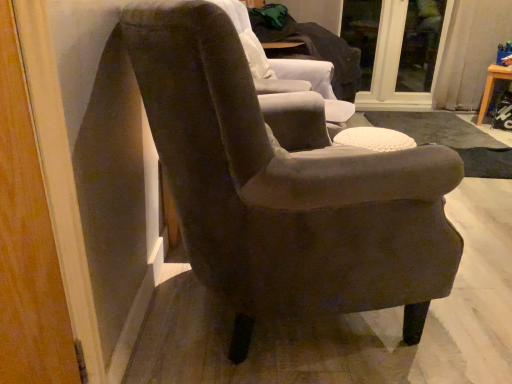
This screenshot has height=384, width=512. In order to click on velvet-like brown armchair at center, which appears as the 1th chair when viewed from the back in this screenshot , I will do [x=288, y=68].

Where is `wooden stool at right`? wooden stool at right is located at coordinates [492, 87].

This screenshot has width=512, height=384. I want to click on velvet-like brown armchair at center, placed as the second chair when sorted from front to back, so click(288, 68).

Considering the positions of objects transparent glass door at upper center, which appears as the second glass door when viewed from the right, and suede-like brown armchair at center, arranged as the 1th chair when viewed from the front, in the image provided, who is more to the right, transparent glass door at upper center, which appears as the second glass door when viewed from the right, or suede-like brown armchair at center, arranged as the 1th chair when viewed from the front,?

Positioned to the right is transparent glass door at upper center, which appears as the second glass door when viewed from the right.

From a real-world perspective, is transparent glass door at upper center, which appears as the second glass door when viewed from the right, physically located above or below suede-like brown armchair at center, marked as the second chair in a back-to-front arrangement?

transparent glass door at upper center, which appears as the second glass door when viewed from the right, is below suede-like brown armchair at center, marked as the second chair in a back-to-front arrangement.

Looking at this image, between transparent glass door at upper center, which appears as the second glass door when viewed from the right, and suede-like brown armchair at center, arranged as the 1th chair when viewed from the front, which one is positioned behind?

transparent glass door at upper center, which appears as the second glass door when viewed from the right, is more distant.

Considering the sizes of objects transparent glass door at upper center, which appears as the second glass door when viewed from the right, and suede-like brown armchair at center, arranged as the 1th chair when viewed from the front, in the image provided, who is taller, transparent glass door at upper center, which appears as the second glass door when viewed from the right, or suede-like brown armchair at center, arranged as the 1th chair when viewed from the front,?

transparent glass door at upper center, which appears as the second glass door when viewed from the right.

From the image's perspective, which one is positioned higher, transparent glass door at upper center, positioned as the first glass door in left-to-right order, or wooden stool at right?

From the image's view, transparent glass door at upper center, positioned as the first glass door in left-to-right order, is above.

Considering the sizes of objects transparent glass door at upper center, positioned as the first glass door in left-to-right order, and wooden stool at right in the image provided, who is taller, transparent glass door at upper center, positioned as the first glass door in left-to-right order, or wooden stool at right?

Standing taller between the two is transparent glass door at upper center, positioned as the first glass door in left-to-right order.

Does transparent glass door at upper center, positioned as the first glass door in left-to-right order, lie in front of wooden stool at right?

No, transparent glass door at upper center, positioned as the first glass door in left-to-right order, is behind wooden stool at right.

In the scene shown: Which is correct: transparent glass door at upper center, positioned as the first glass door in left-to-right order, is inside wooden stool at right, or outside of it?

transparent glass door at upper center, positioned as the first glass door in left-to-right order, is spatially situated outside wooden stool at right.

Considering the positions of objects velvet-like brown armchair at center, which appears as the 1th chair when viewed from the back, and wooden stool at right in the image provided, who is behind, velvet-like brown armchair at center, which appears as the 1th chair when viewed from the back, or wooden stool at right?

wooden stool at right is further away from the camera.

Can you tell me how much velvet-like brown armchair at center, placed as the second chair when sorted from front to back, and wooden stool at right differ in facing direction?

velvet-like brown armchair at center, placed as the second chair when sorted from front to back, and wooden stool at right are facing 87 degrees away from each other.

Which is more to the left, velvet-like brown armchair at center, which appears as the 1th chair when viewed from the back, or wooden stool at right?

velvet-like brown armchair at center, which appears as the 1th chair when viewed from the back, is more to the left.

Based on their positions, is transparent glass door at upper center, positioned as the first glass door in left-to-right order, located to the left or right of transparent glass door at upper right, the 2th glass door from the left?

From the image, it's evident that transparent glass door at upper center, positioned as the first glass door in left-to-right order, is to the left of transparent glass door at upper right, the 2th glass door from the left.

Who is bigger, transparent glass door at upper center, which appears as the second glass door when viewed from the right, or transparent glass door at upper right, acting as the first glass door starting from the right?

Bigger between the two is transparent glass door at upper center, which appears as the second glass door when viewed from the right.

Looking at this image, from a real-world perspective, relative to transparent glass door at upper right, acting as the first glass door starting from the right, is transparent glass door at upper center, which appears as the second glass door when viewed from the right, vertically above or below?

transparent glass door at upper center, which appears as the second glass door when viewed from the right, is below transparent glass door at upper right, acting as the first glass door starting from the right.

Consider the image. Is transparent glass door at upper center, which appears as the second glass door when viewed from the right, next to transparent glass door at upper right, the 2th glass door from the left, and touching it?

Yes, transparent glass door at upper center, which appears as the second glass door when viewed from the right, is beside transparent glass door at upper right, the 2th glass door from the left.

Is point (487, 78) farther from viewer compared to point (324, 80)?

That is True.

In terms of width, does wooden stool at right look wider or thinner when compared to velvet-like brown armchair at center, which appears as the 1th chair when viewed from the back?

Considering their sizes, wooden stool at right looks slimmer than velvet-like brown armchair at center, which appears as the 1th chair when viewed from the back.

From the image's perspective, is wooden stool at right below velvet-like brown armchair at center, which appears as the 1th chair when viewed from the back?

Indeed, from the image's perspective, wooden stool at right is shown beneath velvet-like brown armchair at center, which appears as the 1th chair when viewed from the back.

In the image, is wooden stool at right on the left side or the right side of velvet-like brown armchair at center, placed as the second chair when sorted from front to back?

Clearly, wooden stool at right is on the right of velvet-like brown armchair at center, placed as the second chair when sorted from front to back, in the image.

Would you say suede-like brown armchair at center, marked as the second chair in a back-to-front arrangement, is a long distance from transparent glass door at upper right, acting as the first glass door starting from the right?

Indeed, suede-like brown armchair at center, marked as the second chair in a back-to-front arrangement, is not near transparent glass door at upper right, acting as the first glass door starting from the right.

Considering the sizes of objects suede-like brown armchair at center, arranged as the 1th chair when viewed from the front, and transparent glass door at upper right, the 2th glass door from the left, in the image provided, who is taller, suede-like brown armchair at center, arranged as the 1th chair when viewed from the front, or transparent glass door at upper right, the 2th glass door from the left,?

With more height is transparent glass door at upper right, the 2th glass door from the left.

From the image's perspective, is suede-like brown armchair at center, arranged as the 1th chair when viewed from the front, located above transparent glass door at upper right, the 2th glass door from the left?

No, from the image's perspective, suede-like brown armchair at center, arranged as the 1th chair when viewed from the front, is not above transparent glass door at upper right, the 2th glass door from the left.

Based on the photo, from a real-world perspective, between suede-like brown armchair at center, arranged as the 1th chair when viewed from the front, and transparent glass door at upper right, acting as the first glass door starting from the right, who is vertically lower?

In real-world perspective, suede-like brown armchair at center, arranged as the 1th chair when viewed from the front, is lower.

Where is `the 2nd glass door to the right of the velvet-like brown armchair at center, placed as the second chair when sorted from front to back, starting your count from the anchor`? This screenshot has width=512, height=384. the 2nd glass door to the right of the velvet-like brown armchair at center, placed as the second chair when sorted from front to back, starting your count from the anchor is located at coordinates (420, 45).

Is transparent glass door at upper right, acting as the first glass door starting from the right, situated inside velvet-like brown armchair at center, placed as the second chair when sorted from front to back, or outside?

transparent glass door at upper right, acting as the first glass door starting from the right, is not enclosed by velvet-like brown armchair at center, placed as the second chair when sorted from front to back.

Considering the sizes of objects transparent glass door at upper right, acting as the first glass door starting from the right, and velvet-like brown armchair at center, which appears as the 1th chair when viewed from the back, in the image provided, who is bigger, transparent glass door at upper right, acting as the first glass door starting from the right, or velvet-like brown armchair at center, which appears as the 1th chair when viewed from the back,?

velvet-like brown armchair at center, which appears as the 1th chair when viewed from the back, is bigger.

Can you tell me how much transparent glass door at upper right, acting as the first glass door starting from the right, and velvet-like brown armchair at center, which appears as the 1th chair when viewed from the back, differ in facing direction?

The angle between the facing direction of transparent glass door at upper right, acting as the first glass door starting from the right, and the facing direction of velvet-like brown armchair at center, which appears as the 1th chair when viewed from the back, is 55.3 degrees.

I want to click on glass door that is the 1st one when counting rightward from the suede-like brown armchair at center, arranged as the 1th chair when viewed from the front, so click(405, 55).

Where is `the 1st glass door positioned above the wooden stool at right (from a real-world perspective)`? the 1st glass door positioned above the wooden stool at right (from a real-world perspective) is located at coordinates (405, 55).

Looking at the image, which one is located closer to transparent glass door at upper right, acting as the first glass door starting from the right, wooden stool at right or transparent glass door at upper center, positioned as the first glass door in left-to-right order?

transparent glass door at upper center, positioned as the first glass door in left-to-right order, is positioned closer to the anchor transparent glass door at upper right, acting as the first glass door starting from the right.

Looking at this image, looking at the image, which one is located closer to wooden stool at right, velvet-like brown armchair at center, placed as the second chair when sorted from front to back, or transparent glass door at upper center, positioned as the first glass door in left-to-right order?

transparent glass door at upper center, positioned as the first glass door in left-to-right order, is closer to wooden stool at right.

Looking at the image, which one is located further to transparent glass door at upper right, the 2th glass door from the left, wooden stool at right or suede-like brown armchair at center, marked as the second chair in a back-to-front arrangement?

Based on the image, suede-like brown armchair at center, marked as the second chair in a back-to-front arrangement, appears to be further to transparent glass door at upper right, the 2th glass door from the left.

Estimate the real-world distances between objects in this image. Which object is further from suede-like brown armchair at center, arranged as the 1th chair when viewed from the front, transparent glass door at upper center, positioned as the first glass door in left-to-right order, or velvet-like brown armchair at center, placed as the second chair when sorted from front to back?

transparent glass door at upper center, positioned as the first glass door in left-to-right order.

Based on their spatial positions, is suede-like brown armchair at center, marked as the second chair in a back-to-front arrangement, or transparent glass door at upper center, positioned as the first glass door in left-to-right order, further from transparent glass door at upper right, the 2th glass door from the left?

suede-like brown armchair at center, marked as the second chair in a back-to-front arrangement, is further to transparent glass door at upper right, the 2th glass door from the left.

Considering their positions, is wooden stool at right positioned closer to suede-like brown armchair at center, arranged as the 1th chair when viewed from the front, than transparent glass door at upper right, the 2th glass door from the left?

The object closer to suede-like brown armchair at center, arranged as the 1th chair when viewed from the front, is wooden stool at right.

When comparing their distances from transparent glass door at upper right, the 2th glass door from the left, does transparent glass door at upper center, positioned as the first glass door in left-to-right order, or wooden stool at right seem further?

Among the two, wooden stool at right is located further to transparent glass door at upper right, the 2th glass door from the left.

Estimate the real-world distances between objects in this image. Which object is closer to transparent glass door at upper right, acting as the first glass door starting from the right, suede-like brown armchair at center, arranged as the 1th chair when viewed from the front, or velvet-like brown armchair at center, placed as the second chair when sorted from front to back?

Based on the image, velvet-like brown armchair at center, placed as the second chair when sorted from front to back, appears to be nearer to transparent glass door at upper right, acting as the first glass door starting from the right.

Find the location of `chair between suede-like brown armchair at center, arranged as the 1th chair when viewed from the front, and transparent glass door at upper right, the 2th glass door from the left, along the z-axis`. chair between suede-like brown armchair at center, arranged as the 1th chair when viewed from the front, and transparent glass door at upper right, the 2th glass door from the left, along the z-axis is located at coordinates (288, 68).

Where is `glass door between transparent glass door at upper center, which appears as the second glass door when viewed from the right, and wooden stool at right from left to right`? This screenshot has width=512, height=384. glass door between transparent glass door at upper center, which appears as the second glass door when viewed from the right, and wooden stool at right from left to right is located at coordinates (420, 45).

In order to click on table between suede-like brown armchair at center, marked as the second chair in a back-to-front arrangement, and transparent glass door at upper right, acting as the first glass door starting from the right, from front to back in this screenshot , I will do `click(492, 87)`.

Where is `chair between suede-like brown armchair at center, marked as the second chair in a back-to-front arrangement, and transparent glass door at upper center, which appears as the second glass door when viewed from the right, along the z-axis`? Image resolution: width=512 pixels, height=384 pixels. chair between suede-like brown armchair at center, marked as the second chair in a back-to-front arrangement, and transparent glass door at upper center, which appears as the second glass door when viewed from the right, along the z-axis is located at coordinates (288, 68).